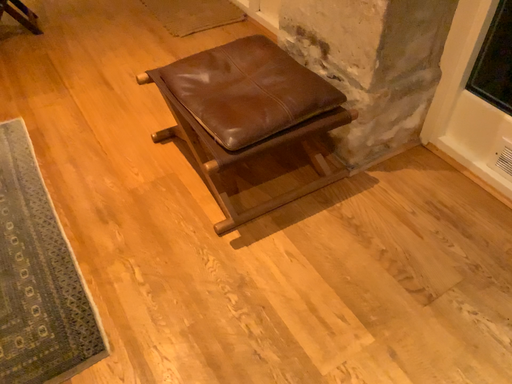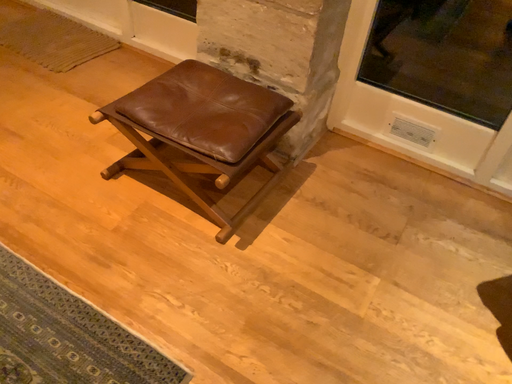
Question: Which way did the camera rotate in the video?

Choices:
 (A) rotated right
 (B) rotated left

Answer: (A)